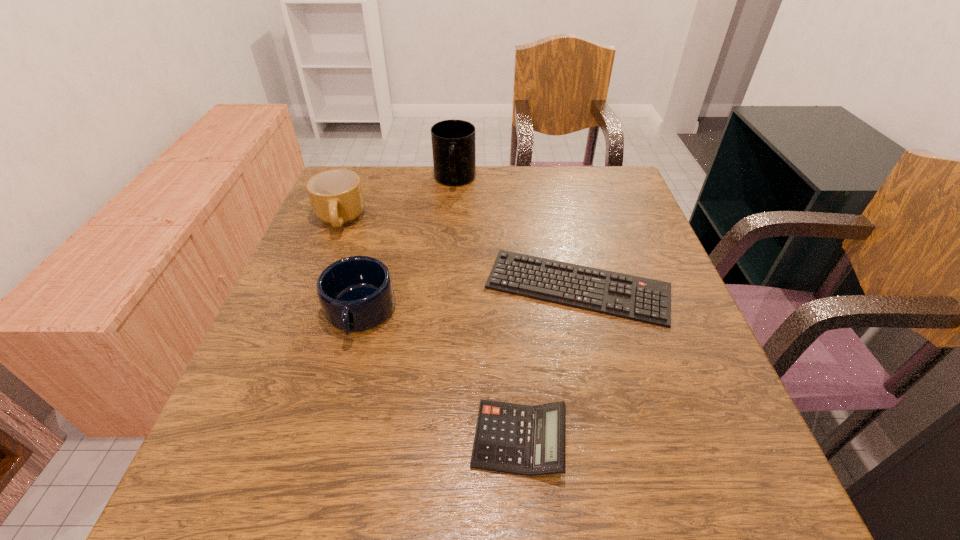
Identify the location of blank space that satisfies the following two spatial constraints: 1. on the side of the calculator with the handle; 2. on the left side of the farthest mug. (434, 439).

The height and width of the screenshot is (540, 960). What are the coordinates of `vacant point that satisfies the following two spatial constraints: 1. on the side with the handle of the computer keyboard; 2. on the left side of the second farthest object` in the screenshot? It's located at (313, 288).

Where is `free space that satisfies the following two spatial constraints: 1. on the side of the farthest object with the handle; 2. on the left side of the calculator`? Image resolution: width=960 pixels, height=540 pixels. free space that satisfies the following two spatial constraints: 1. on the side of the farthest object with the handle; 2. on the left side of the calculator is located at coordinates (434, 439).

Find the location of a particular element. This screenshot has height=540, width=960. vacant area in the image that satisfies the following two spatial constraints: 1. on the side of the tallest object with the handle; 2. on the left side of the shortest object is located at coordinates (446, 288).

Locate an element on the screen. This screenshot has width=960, height=540. free space that satisfies the following two spatial constraints: 1. with the handle on the side of the nearest mug; 2. on the right side of the nearest object is located at coordinates (325, 439).

Where is `free location that satisfies the following two spatial constraints: 1. with the handle on the side of the nearest object; 2. on the left side of the nearest mug`? free location that satisfies the following two spatial constraints: 1. with the handle on the side of the nearest object; 2. on the left side of the nearest mug is located at coordinates (325, 439).

Image resolution: width=960 pixels, height=540 pixels. I want to click on vacant area in the image that satisfies the following two spatial constraints: 1. on the side with the handle of the fourth nearest object; 2. on the left side of the calculator, so click(253, 439).